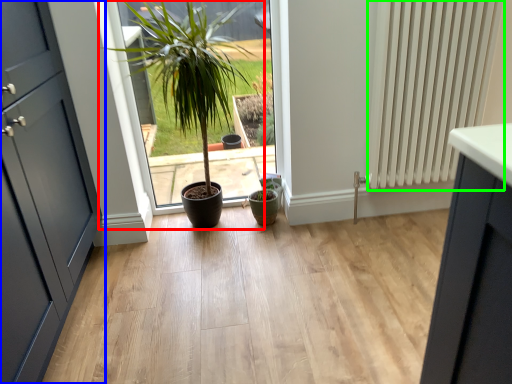
Question: Based on their relative distances, which object is nearer to houseplant (highlighted by a red box)? Choose from door (highlighted by a blue box) and radiator (highlighted by a green box).

Choices:
 (A) door
 (B) radiator

Answer: (A)